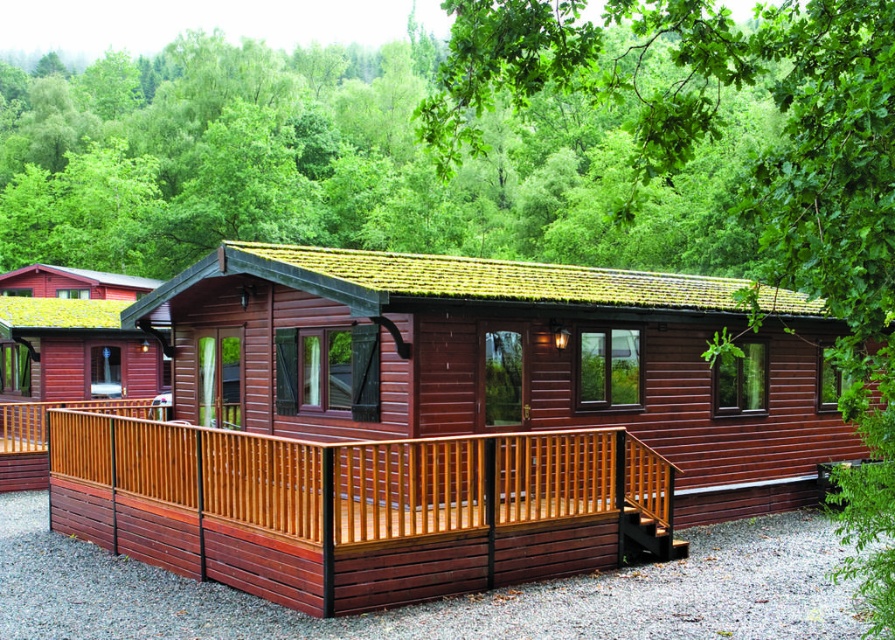
Question: Which point is closer to the camera?

Choices:
 (A) (868, 49)
 (B) (800, 330)
 (C) (270, 483)

Answer: (A)

Question: Estimate the real-world distances between objects in this image. Which object is closer to the green leafy tree at upper center?

Choices:
 (A) matte wood log cabin at center
 (B) wooden deck at lower center

Answer: (A)

Question: Is wooden deck at lower center further to camera compared to green leafy tree at upper center?

Choices:
 (A) no
 (B) yes

Answer: (B)

Question: Is wooden deck at lower center to the right of green leafy tree at upper center from the viewer's perspective?

Choices:
 (A) yes
 (B) no

Answer: (B)

Question: Considering the relative positions of wooden deck at lower center and green leafy tree at upper center in the image provided, where is wooden deck at lower center located with respect to green leafy tree at upper center?

Choices:
 (A) left
 (B) right

Answer: (A)

Question: Which point is closer to the camera?

Choices:
 (A) (667, 320)
 (B) (320, 580)
 (C) (771, 275)

Answer: (C)